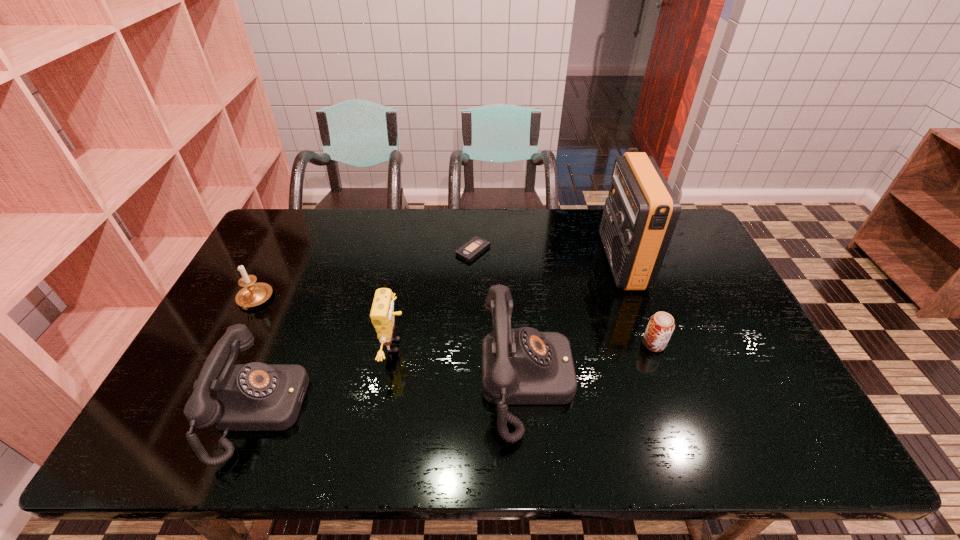
Image resolution: width=960 pixels, height=540 pixels. Identify the location of sponge that is at the near edge. (382, 314).

Identify the location of telephone that is at the left edge. The image size is (960, 540). (255, 396).

The width and height of the screenshot is (960, 540). Identify the location of candle holder present at the left edge. [253, 294].

You are a GUI agent. You are given a task and a screenshot of the screen. Output one action in this format:
    pyautogui.click(x=<x>, y=<y>)
    Task: Click on the object that is at the near left corner
    The height and width of the screenshot is (540, 960).
    Given the screenshot: What is the action you would take?
    pyautogui.click(x=255, y=396)

Find the location of a particular element. vacant space at the far edge of the desktop is located at coordinates (413, 225).

Find the location of a particular element. Image resolution: width=960 pixels, height=540 pixels. vacant space at the right edge of the desktop is located at coordinates (738, 338).

The image size is (960, 540). In the image, there is a desktop. In order to click on vacant space at the far left corner in this screenshot , I will do `click(296, 211)`.

Find the location of `vacant space that's between the left telephone and the sixth tallest object`. vacant space that's between the left telephone and the sixth tallest object is located at coordinates (458, 376).

You are a GUI agent. You are given a task and a screenshot of the screen. Output one action in this format:
    pyautogui.click(x=<x>, y=<y>)
    Task: Click on the free spot between the shorter telephone and the sponge
    Image resolution: width=960 pixels, height=540 pixels.
    Given the screenshot: What is the action you would take?
    pyautogui.click(x=328, y=377)

Where is `free space between the third shortest object and the beer can`? This screenshot has height=540, width=960. free space between the third shortest object and the beer can is located at coordinates (454, 322).